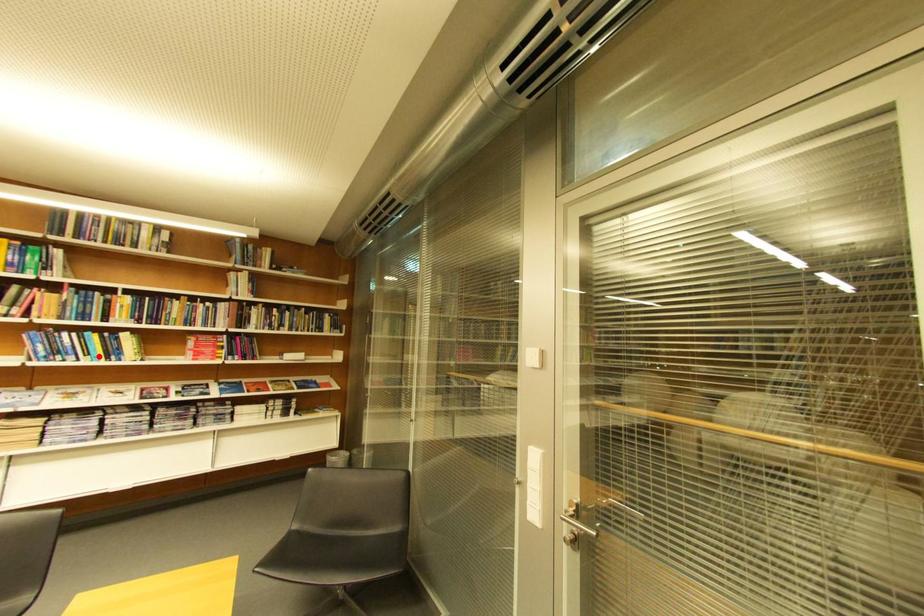
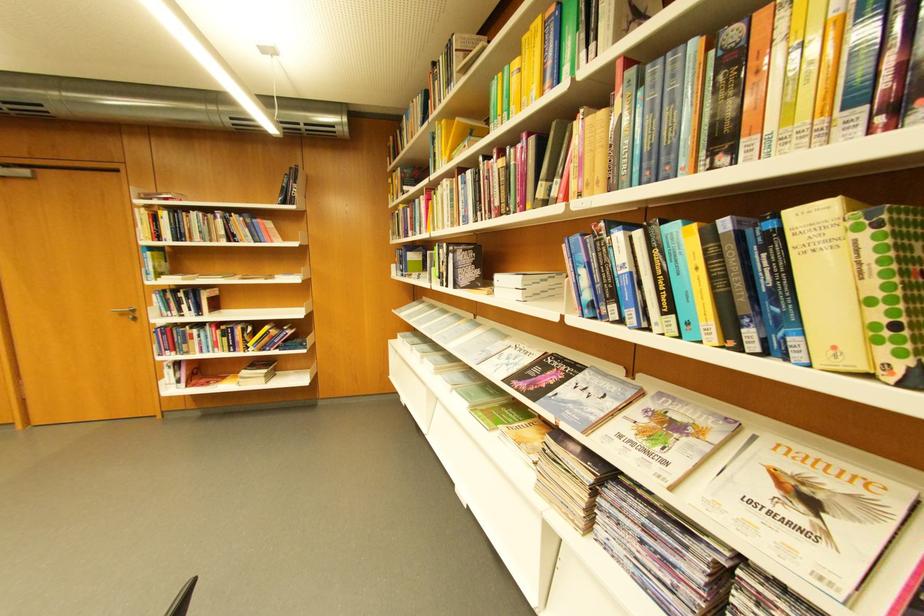
Find the pixel in the second image that matches the highlighted location in the first image.

(681, 310)